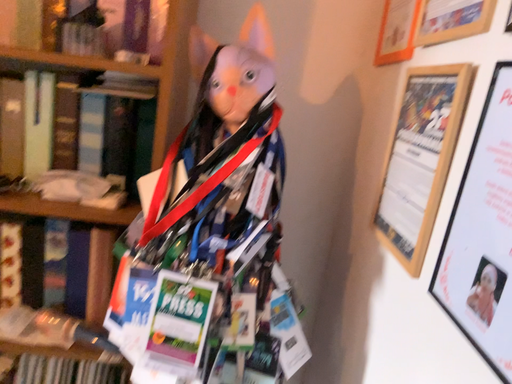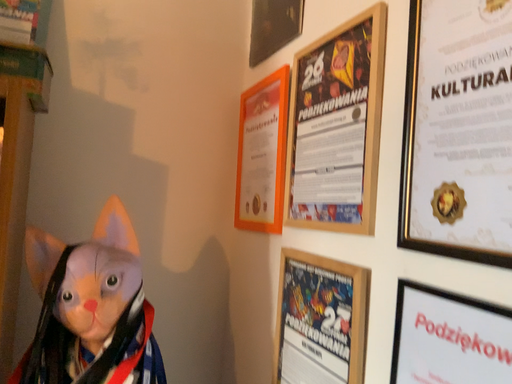
Question: How did the camera likely rotate when shooting the video?

Choices:
 (A) rotated upward
 (B) rotated downward

Answer: (A)